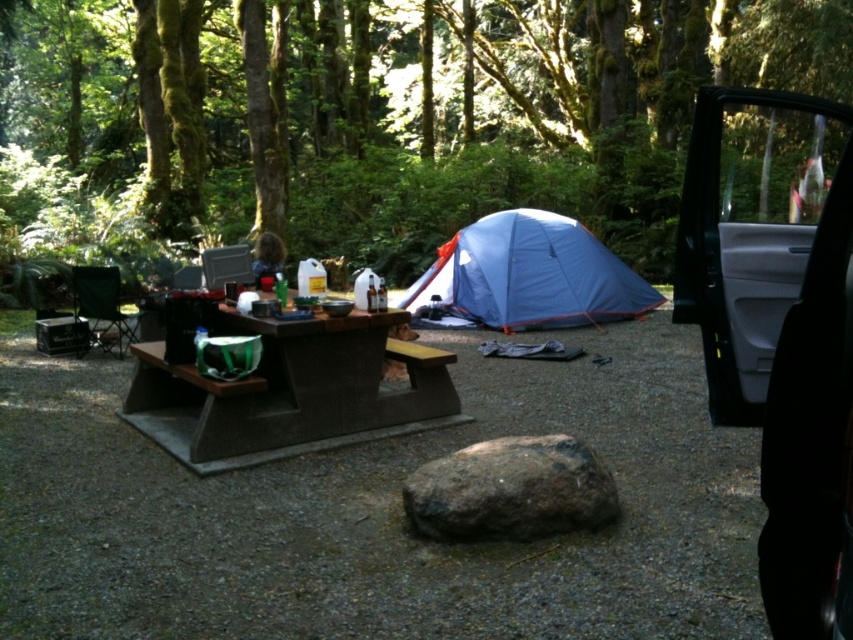
Does blue fabric tent at center appear under brown wood table at center?

Incorrect, blue fabric tent at center is not positioned below brown wood table at center.

Can you confirm if blue fabric tent at center is positioned to the left of brown wood table at center?

In fact, blue fabric tent at center is to the right of brown wood table at center.

Is point (561, 269) positioned after point (352, 378)?

Yes.

Where is `blue fabric tent at center`? The image size is (853, 640). blue fabric tent at center is located at coordinates (527, 276).

Does brown wood picnic table at center have a lesser height compared to blue fabric tent at center?

Indeed, brown wood picnic table at center has a lesser height compared to blue fabric tent at center.

Which is behind, point (222, 451) or point (492, 308)?

Positioned behind is point (492, 308).

Locate an element on the screen. This screenshot has height=640, width=853. brown wood picnic table at center is located at coordinates (289, 392).

Who is taller, green mossy tree at upper center or brown wood table at center?

Standing taller between the two is green mossy tree at upper center.

Is the position of green mossy tree at upper center more distant than that of brown wood table at center?

No, it is in front of brown wood table at center.

Does point (636, 173) lie in front of point (357, 372)?

No, it is not.

At what (x,y) coordinates should I click in order to perform the action: click on green mossy tree at upper center. Please return your answer as a coordinate pair (x, y). The height and width of the screenshot is (640, 853). Looking at the image, I should click on (373, 116).